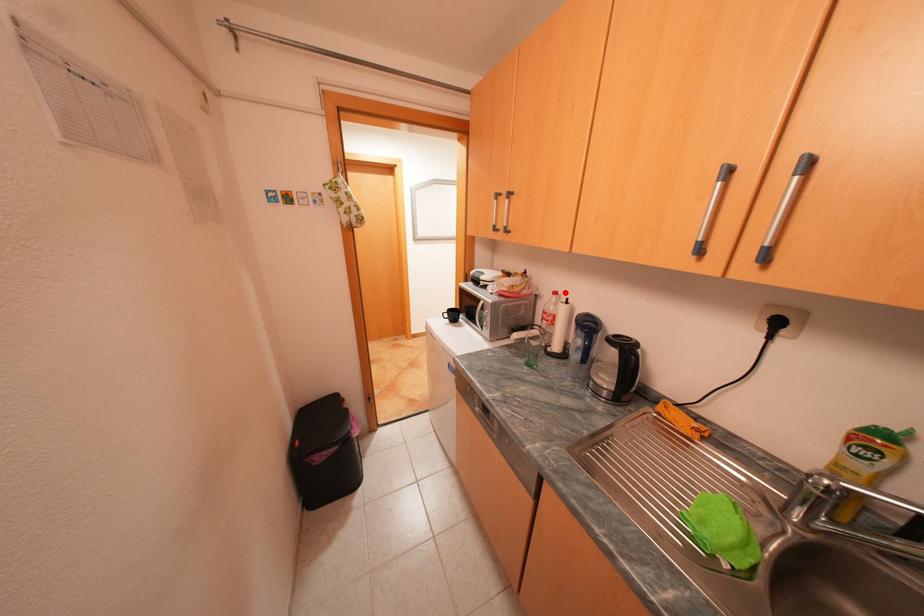
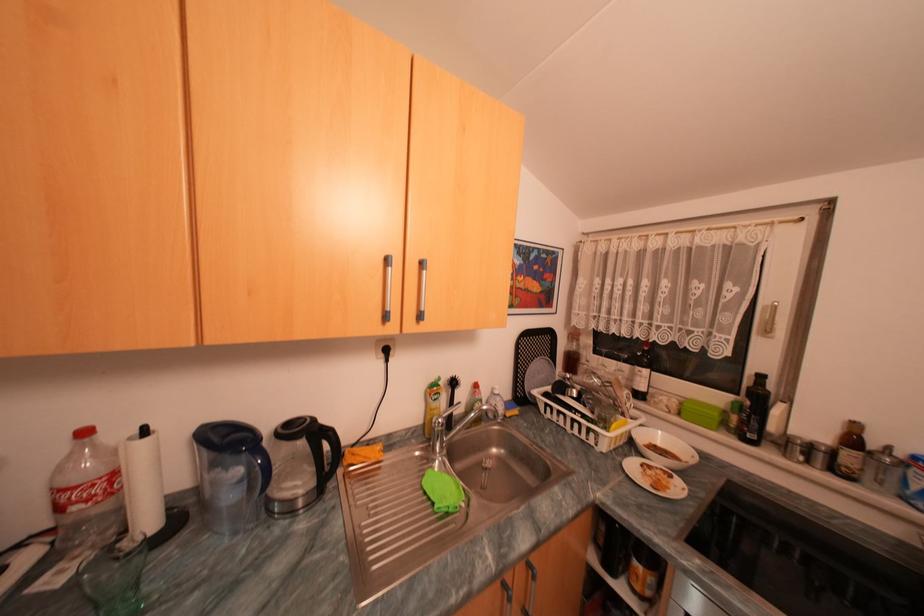
Locate, in the second image, the point that corresponds to the highlighted location in the first image.

(94, 432)